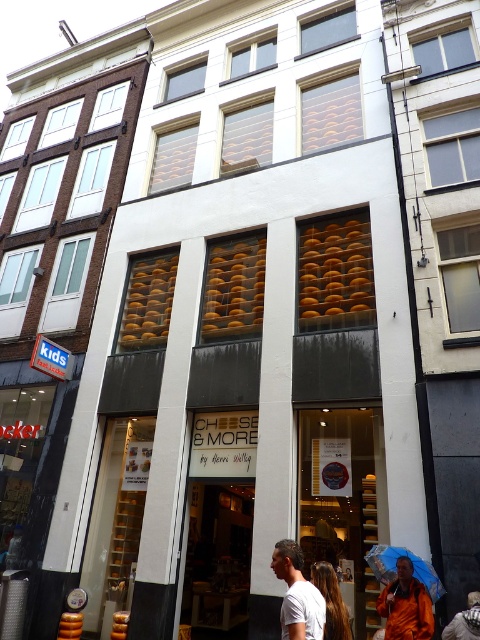
You are standing in front of the Cheese and More store and notice two umbrellas outside. The orange fabric umbrella at center and the blue fabric umbrella at lower center. Which umbrella is smaller?

The orange fabric umbrella at center is smaller than the blue fabric umbrella at lower center.